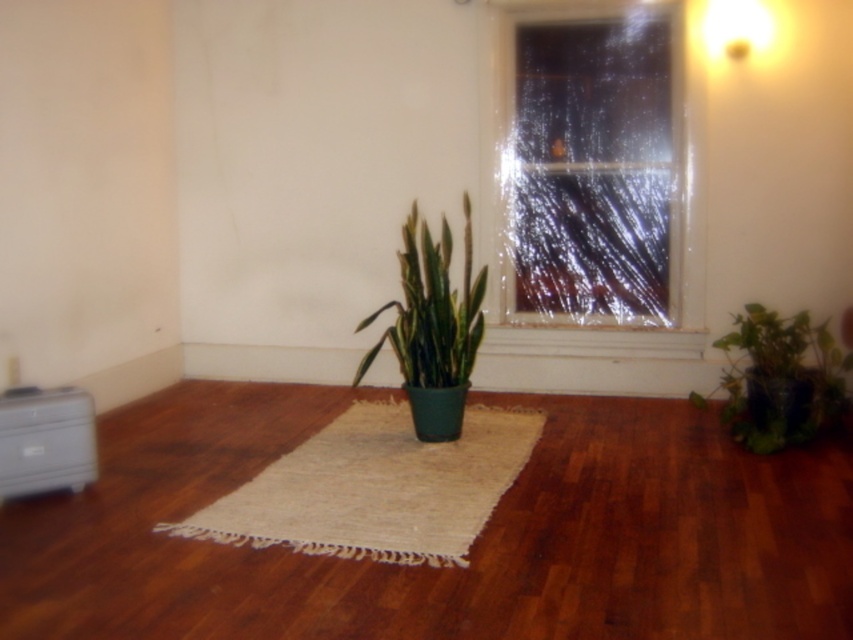
You are standing in the room and want to place a new plant exactly at the center of the room. The existing green matte plant at lower right is in the way. Where should you move it to make space?

The green matte plant at lower right is currently at position (781,378). To make space for the new plant at the center, you should move it to a different location away from the center coordinates.

You are standing at the center of the room facing the window. There are two points marked in the room, point A at point [790,433] and point B at point [80,444]. Which point is closer to the window?

Point B at point [80,444] is closer to the window because it is in front of point A at point [790,433].